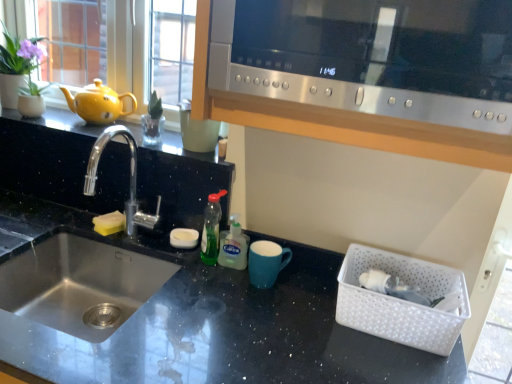
I want to click on vacant space positioned to the left of white plastic basket at lower right, so 294,319.